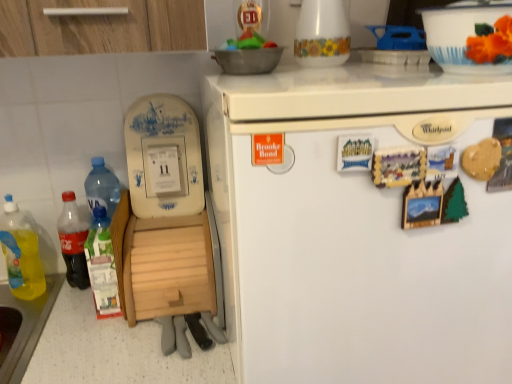
Question: Does translucent plastic bottle at lower left, arranged as the first bottle when viewed from the right, turn towards white glossy bowl at upper right?

Choices:
 (A) no
 (B) yes

Answer: (A)

Question: Can you confirm if translucent plastic bottle at lower left, placed as the 3th bottle when sorted from left to right, is wider than white glossy bowl at upper right?

Choices:
 (A) yes
 (B) no

Answer: (B)

Question: From a real-world perspective, is translucent plastic bottle at lower left, placed as the 3th bottle when sorted from left to right, under white glossy bowl at upper right?

Choices:
 (A) yes
 (B) no

Answer: (A)

Question: Is translucent plastic bottle at lower left, arranged as the first bottle when viewed from the right, not close to white glossy bowl at upper right?

Choices:
 (A) no
 (B) yes

Answer: (A)

Question: Considering the relative sizes of translucent plastic bottle at lower left, arranged as the first bottle when viewed from the right, and white glossy bowl at upper right in the image provided, is translucent plastic bottle at lower left, arranged as the first bottle when viewed from the right, shorter than white glossy bowl at upper right?

Choices:
 (A) no
 (B) yes

Answer: (A)

Question: Is translucent plastic bottle at lower left, placed as the 3th bottle when sorted from left to right, smaller than white glossy bowl at upper right?

Choices:
 (A) yes
 (B) no

Answer: (A)

Question: Is white matte refrigerator at upper right closer to camera compared to white ceramic vase at upper center?

Choices:
 (A) yes
 (B) no

Answer: (A)

Question: Is white matte refrigerator at upper right thinner than white ceramic vase at upper center?

Choices:
 (A) no
 (B) yes

Answer: (A)

Question: From the image's perspective, is white matte refrigerator at upper right beneath white ceramic vase at upper center?

Choices:
 (A) no
 (B) yes

Answer: (B)

Question: From the image's perspective, is white matte refrigerator at upper right located above white ceramic vase at upper center?

Choices:
 (A) yes
 (B) no

Answer: (B)

Question: Does white matte refrigerator at upper right have a lesser height compared to white ceramic vase at upper center?

Choices:
 (A) no
 (B) yes

Answer: (A)

Question: Is white matte refrigerator at upper right facing away from white ceramic vase at upper center?

Choices:
 (A) no
 (B) yes

Answer: (A)

Question: Is wooden at left surrounded by translucent plastic soda bottle at left, marked as the second bottle in a right-to-left arrangement?

Choices:
 (A) yes
 (B) no

Answer: (B)